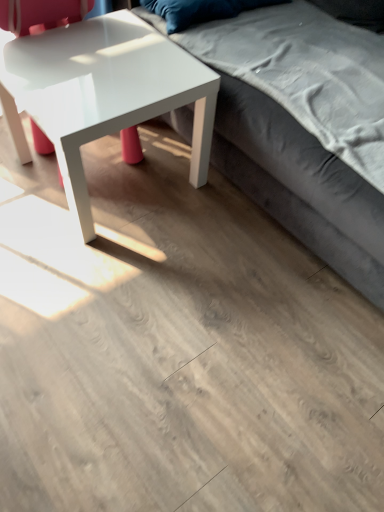
Question: Is velvet blue pillow at upper center taller or shorter than velvet gray couch at upper right?

Choices:
 (A) short
 (B) tall

Answer: (A)

Question: From the image's perspective, is velvet blue pillow at upper center positioned above or below velvet gray couch at upper right?

Choices:
 (A) below
 (B) above

Answer: (B)

Question: Estimate the real-world distances between objects in this image. Which object is farther from the velvet blue pillow at upper center?

Choices:
 (A) velvet gray couch at upper right
 (B) glossy white coffee table at left

Answer: (A)

Question: Which object is the farthest from the velvet blue pillow at upper center?

Choices:
 (A) velvet gray couch at upper right
 (B) glossy white coffee table at left

Answer: (A)